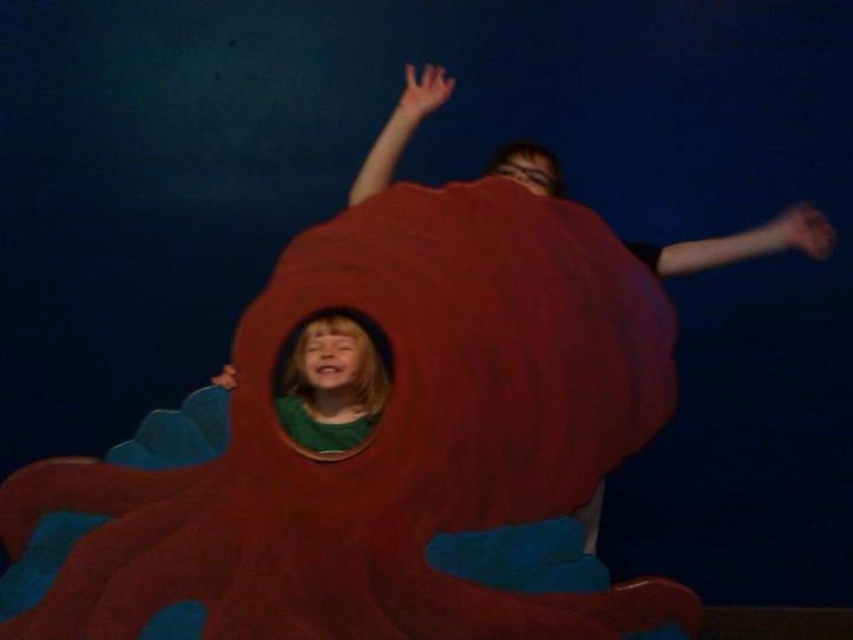
You are standing in front of the matte red octopus at center. If you take one step forward, will you be closer than 1.5 meters to it?

The matte red octopus at center is currently 1.79 meters away from you. Taking one step forward would reduce the distance, but without knowing your step length, it is impossible to determine if you would be closer than 1.5 meters.

You are a game designer creating an obstacle course. The matte red octopus at center is placed at coordinates 0.703 on the x and 0.445 on the y. If the starting point is at the origin, which direction should participants move to reach the octopus first?

Participants should move towards the positive x and positive y directions since the matte red octopus at center is located at coordinates (379, 449), which is northeast of the origin.

You are a photographer trying to capture a photo of both the point at position (131, 604) and the point at position (311, 400) in the image. To ensure both points are visible in the frame, which point should you focus on first?

You should focus on the point at position (131, 604) first because it is in front of the point at position (311, 400), so it will be closer to the camera and easier to capture in the frame.